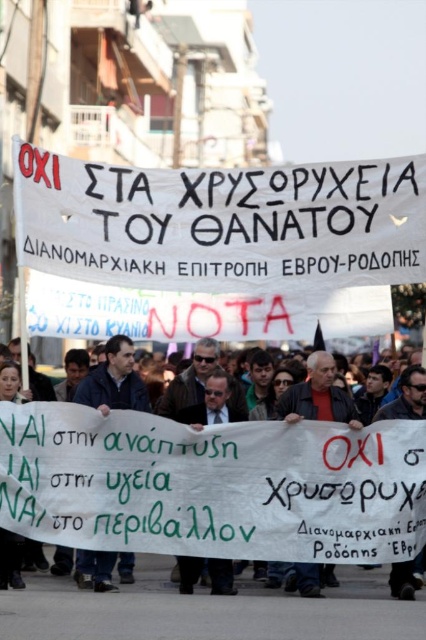
Is point (391, 472) positioned in front of point (77, 561)?

Yes, point (391, 472) is closer to viewer.

Between white paper banner at center and blue fabric at center, which one has less height?

With less height is white paper banner at center.

Is point (291, 552) less distant than point (104, 586)?

Yes, point (291, 552) is closer to viewer.

At what (x,y) coordinates should I click in order to perform the action: click on white paper banner at center. Please return your answer as a coordinate pair (x, y). The image size is (426, 640). Looking at the image, I should click on (210, 486).